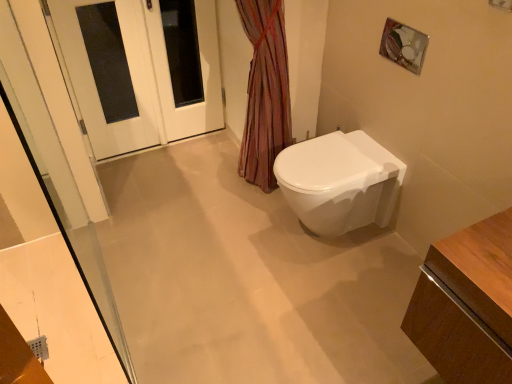
Locate an element on the screen. The height and width of the screenshot is (384, 512). free space that is to the left of white glossy toilet at center-right is located at coordinates (240, 238).